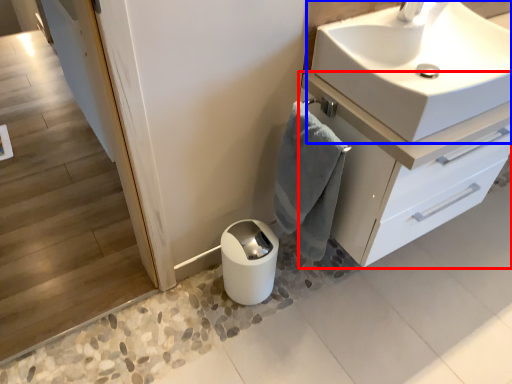
Question: Which point is closer to the camera, bathroom cabinet (highlighted by a red box) or sink (highlighted by a blue box)?

Choices:
 (A) bathroom cabinet
 (B) sink

Answer: (B)